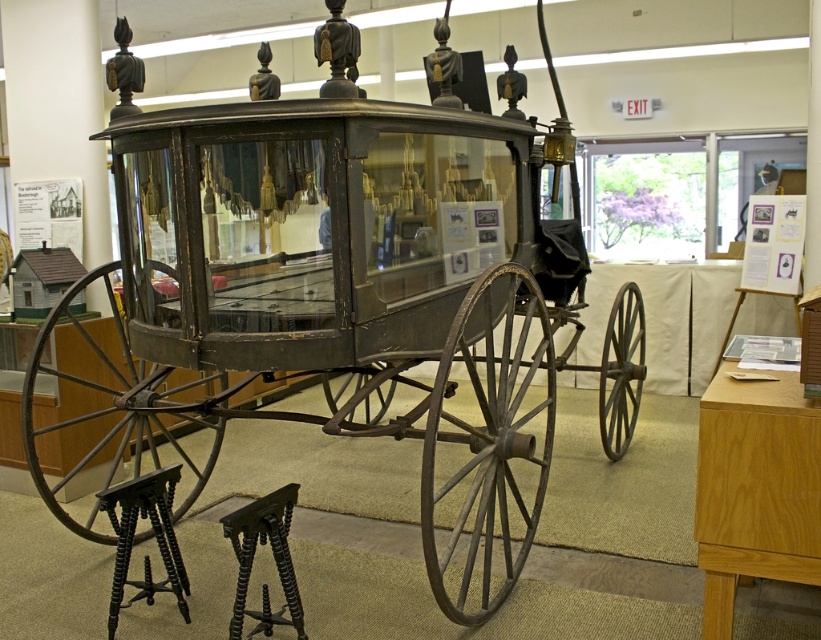
You are an interior designer assessing the space for accessibility. You need to place a 1.5 meter tall decorative item in the room. Which of the two stools, the black wood stool at lower left or the black twisted wood stool at lower left, is more suitable to place the item on so it can be seen over from the entrance?

The black wood stool at lower left is much taller than the black twisted wood stool at lower left, so placing the 1.5 meter tall item on the black wood stool at lower left would make it visible over from the entrance.

You are a visitor in the museum and want to sit down. You see a black wood stool at lower left and a black twisted wood stool at lower left. Which stool is wider?

The black wood stool at lower left might be wider than black twisted wood stool at lower left according to the description.

You are a tour guide leading a group through the museum. You need to move a 20 inch wide painting to the space between the black wood stool at lower left and the black twisted wood stool at lower left. Is there enough space for the painting?

The distance between the black wood stool at lower left and the black twisted wood stool at lower left is 19.25 inches. Since the painting is 20 inches wide, it will not fit in the space between them.